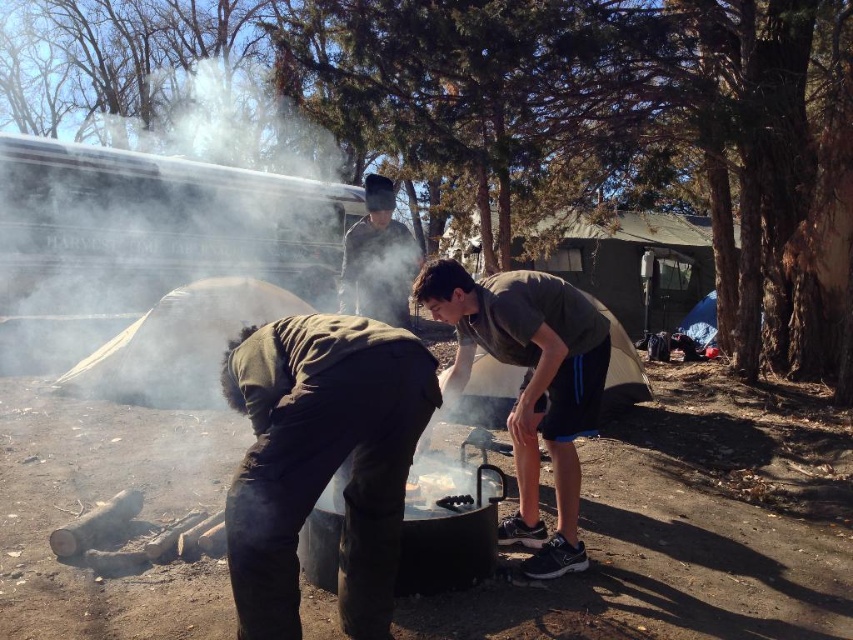
Does dark gray knit hat at center appear under green fabric tent at center?

No, dark gray knit hat at center is not below green fabric tent at center.

Which is above, dark gray knit hat at center or green fabric tent at center?

Positioned higher is dark gray knit hat at center.

Identify the location of dark gray knit hat at center. (378, 259).

Is dark green fabric at lower left positioned in front of white canvas tent at center?

Yes, it is.

Where is `dark green fabric at lower left`? This screenshot has height=640, width=853. dark green fabric at lower left is located at coordinates (321, 461).

Which is above, dark gray fabric shirt at center or white canvas tent at center?

Positioned higher is white canvas tent at center.

Looking at this image, who is taller, dark gray fabric shirt at center or white canvas tent at center?

dark gray fabric shirt at center

Which is in front, point (474, 285) or point (144, 390)?

Positioned in front is point (474, 285).

Identify the location of dark gray fabric shirt at center. The height and width of the screenshot is (640, 853). (531, 387).